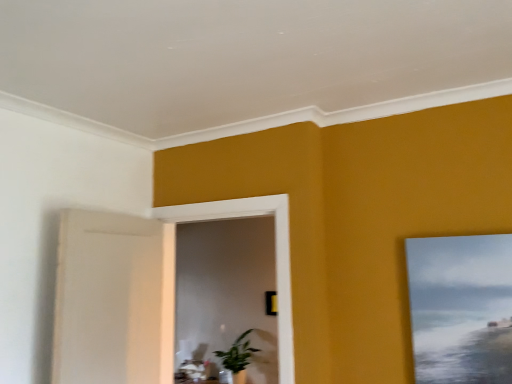
Identify the location of matte canvas painting at upper right. The height and width of the screenshot is (384, 512). click(x=461, y=308).

Describe the element at coordinates (238, 357) in the screenshot. I see `green glossy plant at center` at that location.

You are a GUI agent. You are given a task and a screenshot of the screen. Output one action in this format:
    pyautogui.click(x=<x>, y=<y>)
    Task: Click on the matte canvas painting at upper right
    The height and width of the screenshot is (384, 512).
    Given the screenshot: What is the action you would take?
    pyautogui.click(x=461, y=308)

From the image's perspective, is white wooden frame at center above or below matte canvas painting at upper right?

white wooden frame at center is situated lower than matte canvas painting at upper right in the image.

Who is smaller, white wooden frame at center or matte canvas painting at upper right?

matte canvas painting at upper right is smaller.

Considering the sizes of objects white wooden frame at center and matte canvas painting at upper right in the image provided, who is thinner, white wooden frame at center or matte canvas painting at upper right?

With smaller width is matte canvas painting at upper right.

Based on their sizes in the image, would you say white wooden frame at center is bigger or smaller than green glossy plant at center?

white wooden frame at center is bigger than green glossy plant at center.

From the image's perspective, is white wooden frame at center beneath green glossy plant at center?

No, from the image's perspective, white wooden frame at center is not below green glossy plant at center.

Is white wooden frame at center to the right of green glossy plant at center from the viewer's perspective?

In fact, white wooden frame at center is to the left of green glossy plant at center.

Are green glossy plant at center and matte canvas painting at upper right making contact?

No, green glossy plant at center is not with matte canvas painting at upper right.

Between green glossy plant at center and matte canvas painting at upper right, which one has larger size?

With larger size is green glossy plant at center.

Who is more distant, green glossy plant at center or matte canvas painting at upper right?

green glossy plant at center.

In the scene shown: From a real-world perspective, is green glossy plant at center on matte canvas painting at upper right?

No, from a real-world perspective, green glossy plant at center is not over matte canvas painting at upper right

Between green glossy plant at center and white wooden frame at center, which one is positioned in front?

white wooden frame at center is more forward.

Is green glossy plant at center wider than white wooden frame at center?

Correct, the width of green glossy plant at center exceeds that of white wooden frame at center.

Is green glossy plant at center spatially inside white wooden frame at center, or outside of it?

green glossy plant at center lies outside white wooden frame at center.

Is green glossy plant at center turned away from white wooden frame at center?

No, green glossy plant at center is not facing away from white wooden frame at center.

Considering the sizes of objects matte canvas painting at upper right and white wooden frame at center in the image provided, who is wider, matte canvas painting at upper right or white wooden frame at center?

white wooden frame at center.

Locate an element on the screen. This screenshot has height=384, width=512. picture frame located underneath the white wooden frame at center (from a real-world perspective) is located at coordinates (461, 308).

Considering the positions of objects matte canvas painting at upper right and white wooden frame at center in the image provided, who is more to the right, matte canvas painting at upper right or white wooden frame at center?

From the viewer's perspective, matte canvas painting at upper right appears more on the right side.

How different are the orientations of matte canvas painting at upper right and green glossy plant at center in degrees?

matte canvas painting at upper right and green glossy plant at center are facing 0.435 degrees away from each other.

You are a GUI agent. You are given a task and a screenshot of the screen. Output one action in this format:
    pyautogui.click(x=<x>, y=<y>)
    Task: Click on the picture frame that appears above the green glossy plant at center (from a real-world perspective)
    This screenshot has height=384, width=512.
    Given the screenshot: What is the action you would take?
    pyautogui.click(x=461, y=308)

Considering the relative sizes of matte canvas painting at upper right and green glossy plant at center in the image provided, is matte canvas painting at upper right shorter than green glossy plant at center?

In fact, matte canvas painting at upper right may be taller than green glossy plant at center.

Considering the sizes of objects matte canvas painting at upper right and green glossy plant at center in the image provided, who is smaller, matte canvas painting at upper right or green glossy plant at center?

matte canvas painting at upper right is smaller.

Image resolution: width=512 pixels, height=384 pixels. What are the coordinates of `picture frame in front of the white wooden frame at center` in the screenshot? It's located at (461, 308).

The width and height of the screenshot is (512, 384). In order to click on window that is on the left side of green glossy plant at center in this screenshot , I will do `click(275, 252)`.

When comparing their distances from matte canvas painting at upper right, does green glossy plant at center or white wooden frame at center seem further?

green glossy plant at center is positioned further to the anchor matte canvas painting at upper right.

Which object lies further to the anchor point green glossy plant at center, white wooden frame at center or matte canvas painting at upper right?

Among the two, matte canvas painting at upper right is located further to green glossy plant at center.

Considering their positions, is matte canvas painting at upper right positioned closer to white wooden frame at center than green glossy plant at center?

matte canvas painting at upper right is positioned closer to the anchor white wooden frame at center.

When comparing their distances from white wooden frame at center, does green glossy plant at center or matte canvas painting at upper right seem closer?

Among the two, matte canvas painting at upper right is located nearer to white wooden frame at center.

Estimate the real-world distances between objects in this image. Which object is further from green glossy plant at center, matte canvas painting at upper right or white wooden frame at center?

matte canvas painting at upper right.

Estimate the real-world distances between objects in this image. Which object is further from matte canvas painting at upper right, white wooden frame at center or green glossy plant at center?

Among the two, green glossy plant at center is located further to matte canvas painting at upper right.

Where is `window positioned between matte canvas painting at upper right and green glossy plant at center from near to far`? The image size is (512, 384). window positioned between matte canvas painting at upper right and green glossy plant at center from near to far is located at coordinates (275, 252).